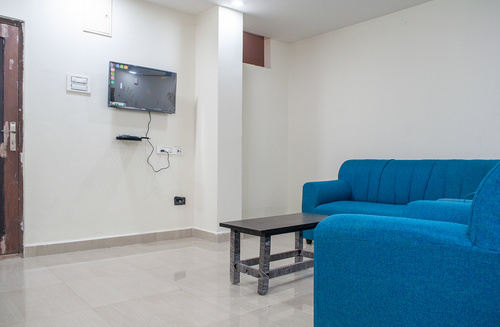
Locate an element on the screen. tiled floor is located at coordinates (102, 291), (169, 280), (226, 312).